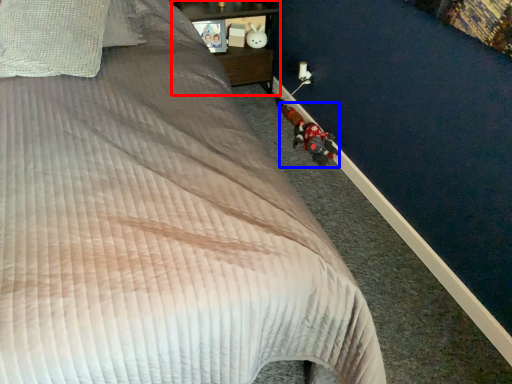
Question: Which point is closer to the camera, furniture (highlighted by a red box) or toy (highlighted by a blue box)?

Choices:
 (A) furniture
 (B) toy

Answer: (B)